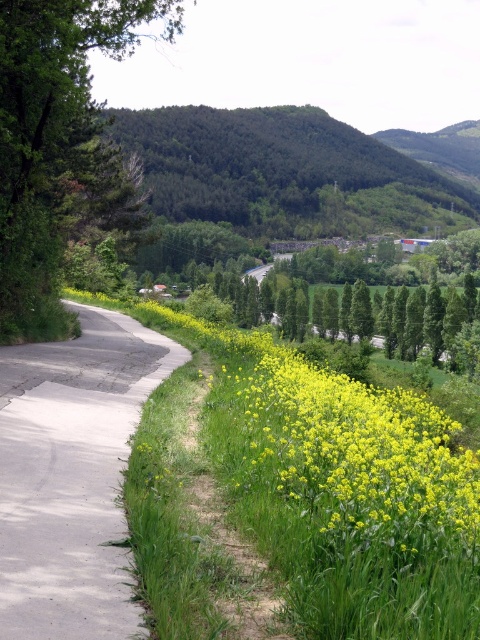
Question: Does green leafy tree at left come behind yellow-green leafy plant at lower center?

Choices:
 (A) no
 (B) yes

Answer: (B)

Question: Among these objects, which one is farthest from the camera?

Choices:
 (A) green leafy tree at left
 (B) yellow-green leafy plant at lower center
 (C) gray concrete road at center

Answer: (A)

Question: Which of the following is the farthest from the observer?

Choices:
 (A) green leafy tree at left
 (B) gray concrete road at center

Answer: (A)

Question: Which point is farther to the camera?

Choices:
 (A) (12, 582)
 (B) (440, 483)

Answer: (B)

Question: Is gray concrete road at center smaller than yellow-green leafy plant at lower center?

Choices:
 (A) no
 (B) yes

Answer: (B)

Question: Can you confirm if gray concrete road at center is thinner than green leafy tree at left?

Choices:
 (A) no
 (B) yes

Answer: (B)